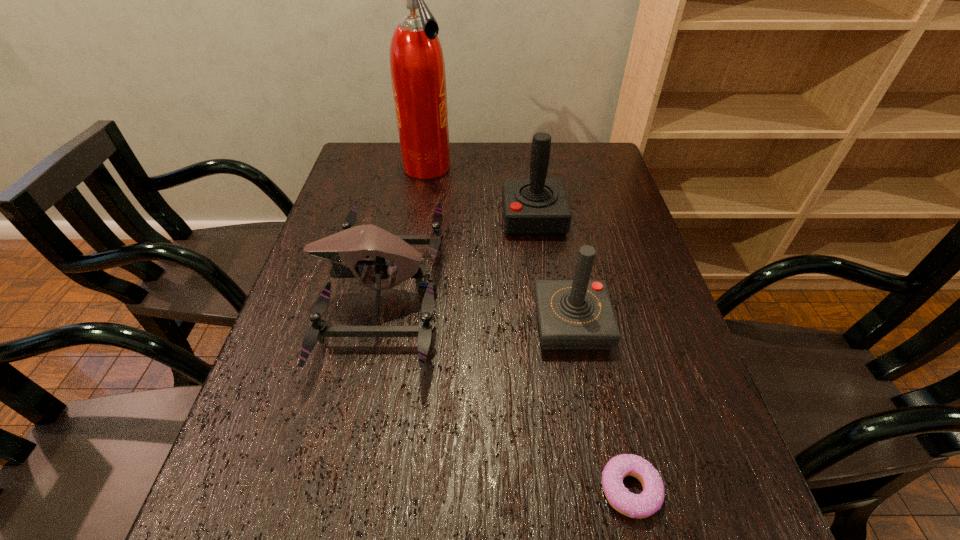
Identify the location of free spot between the tallest object and the farther joystick. (480, 193).

The height and width of the screenshot is (540, 960). I want to click on free point between the farther joystick and the tallest object, so click(x=480, y=193).

Locate an element on the screen. The width and height of the screenshot is (960, 540). vacant area that lies between the shortest object and the farther joystick is located at coordinates (582, 354).

The image size is (960, 540). In order to click on vacant space that's between the farthest object and the third shortest object in this screenshot , I will do `click(499, 246)`.

Where is `free spot between the third shortest object and the farther joystick`? The height and width of the screenshot is (540, 960). free spot between the third shortest object and the farther joystick is located at coordinates (553, 271).

This screenshot has height=540, width=960. What are the coordinates of `unoccupied area between the nearer joystick and the farther joystick` in the screenshot? It's located at (553, 271).

The height and width of the screenshot is (540, 960). I want to click on free space between the shortest object and the second shortest object, so click(506, 392).

At what (x,y) coordinates should I click in order to perform the action: click on object that is the second closest one to the nearest object. Please return your answer as a coordinate pair (x, y). Looking at the image, I should click on (345, 249).

You are a GUI agent. You are given a task and a screenshot of the screen. Output one action in this format:
    pyautogui.click(x=<x>, y=<y>)
    Task: Click on the closest object to the fourth tallest object
    The image size is (960, 540).
    Given the screenshot: What is the action you would take?
    pyautogui.click(x=537, y=206)

You are a GUI agent. You are given a task and a screenshot of the screen. Output one action in this format:
    pyautogui.click(x=<x>, y=<y>)
    Task: Click on the blank space that satisfies the following two spatial constraints: 1. on the back side of the doughnut; 2. on the base of the farther joystick
    The height and width of the screenshot is (540, 960).
    Given the screenshot: What is the action you would take?
    pyautogui.click(x=567, y=218)